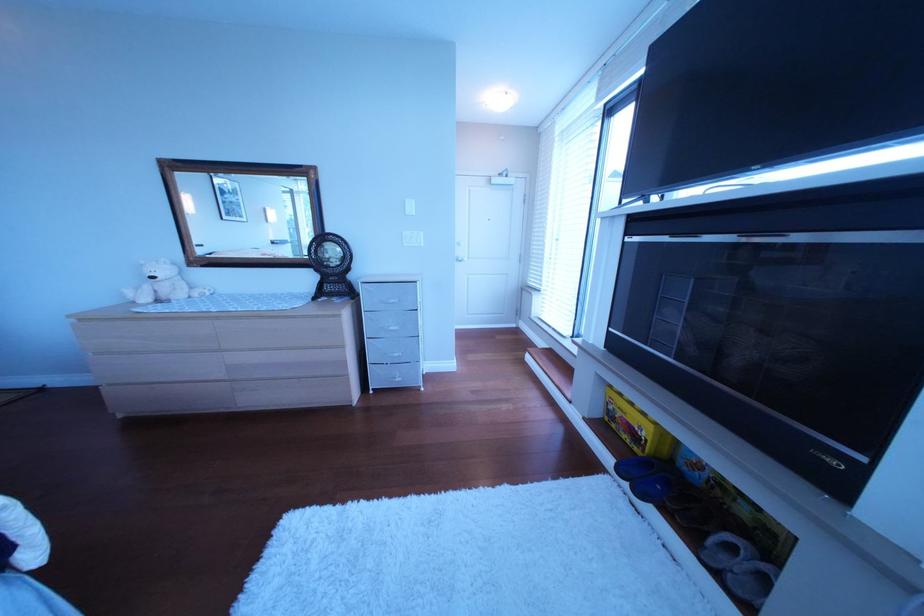
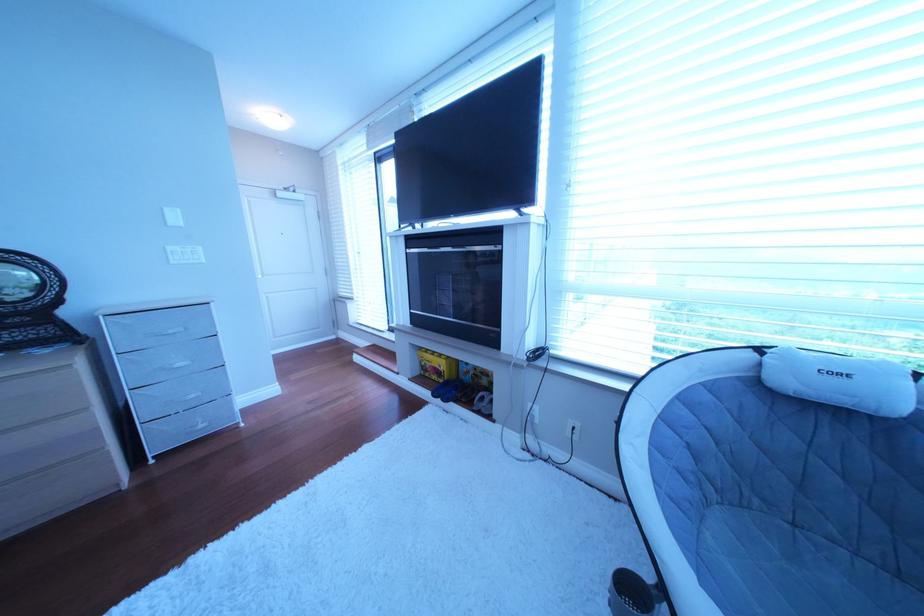
The point at (407, 304) is marked in the first image. Where is the corresponding point in the second image?

(188, 334)